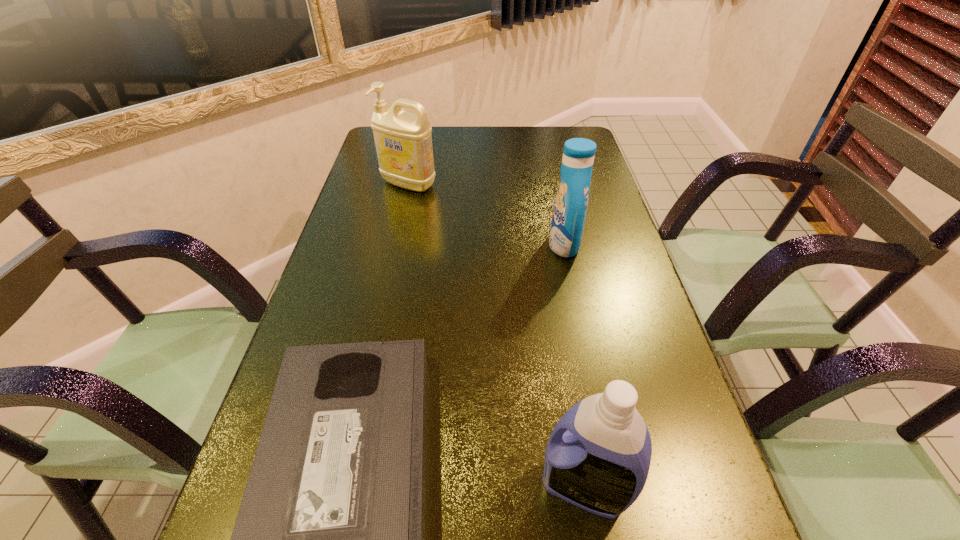
Locate an element on the screen. free space between the nearest detergent and the farthest detergent is located at coordinates (496, 336).

Identify the location of object that can be found as the third closest to the second farthest object. This screenshot has width=960, height=540. (598, 456).

Identify which object is the third nearest to the second nearest detergent. Please provide its 2D coordinates. Your answer should be formatted as a tuple, i.e. [(x, y)], where the tuple contains the x and y coordinates of a point satisfying the conditions above.

[(598, 456)]

Locate an element on the screen. the second closest detergent to the third nearest object is located at coordinates (598, 456).

Identify the location of detergent that is the second closest to the nearest detergent. (403, 141).

At what (x,y) coordinates should I click in order to perform the action: click on vacant region that satisfies the following two spatial constraints: 1. on the front side of the farthest object; 2. on the right side of the nearest detergent. Please return your answer as a coordinate pair (x, y). The image size is (960, 540). Looking at the image, I should click on (344, 487).